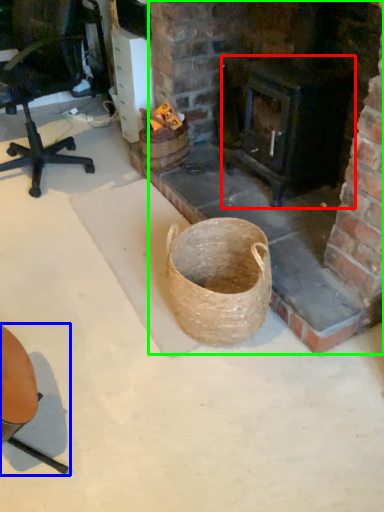
Question: Which object is the farthest from stove (highlighted by a red box)? Choose among these: chair (highlighted by a blue box) or fireplace (highlighted by a green box).

Choices:
 (A) chair
 (B) fireplace

Answer: (A)